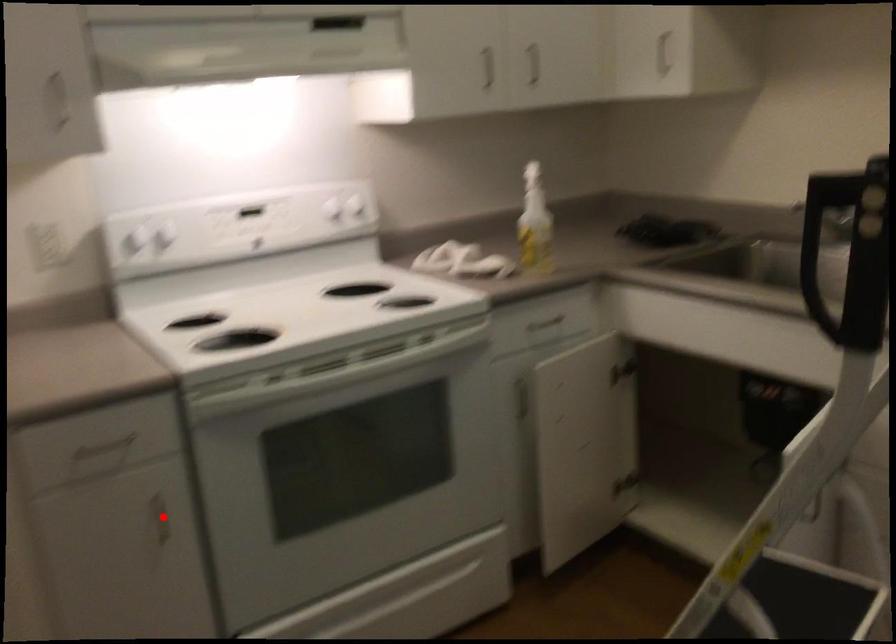
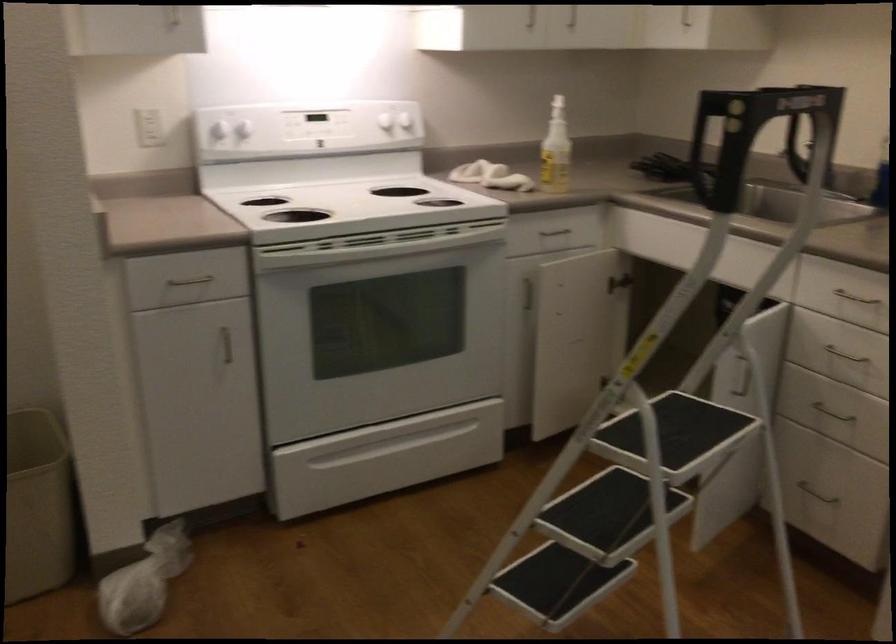
Locate, in the second image, the point that corresponds to the highlighted location in the first image.

(226, 345)